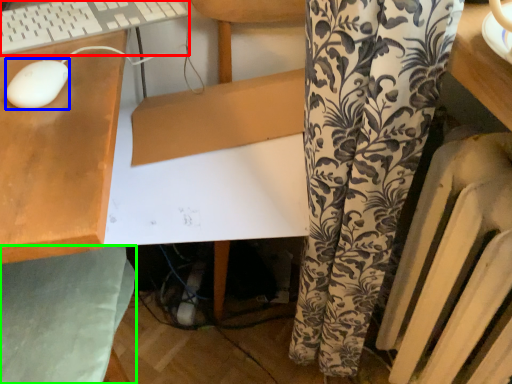
Question: Based on their relative distances, which object is farther from computer keyboard (highlighted by a red box)? Choose from mouse (highlighted by a blue box) and swivel chair (highlighted by a green box).

Choices:
 (A) mouse
 (B) swivel chair

Answer: (B)